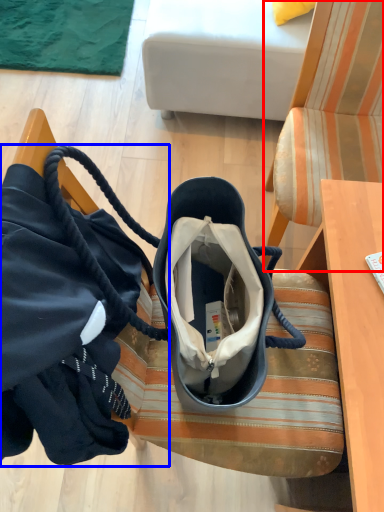
Question: Which of the following is the farthest to the observer, chair (highlighted by a red box) or handbag (highlighted by a blue box)?

Choices:
 (A) chair
 (B) handbag

Answer: (A)